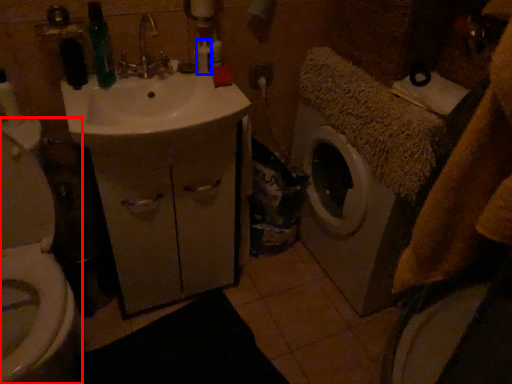
Question: Which of the following is the farthest to the observer, toilet (highlighted by a red box) or toiletry (highlighted by a blue box)?

Choices:
 (A) toilet
 (B) toiletry

Answer: (B)